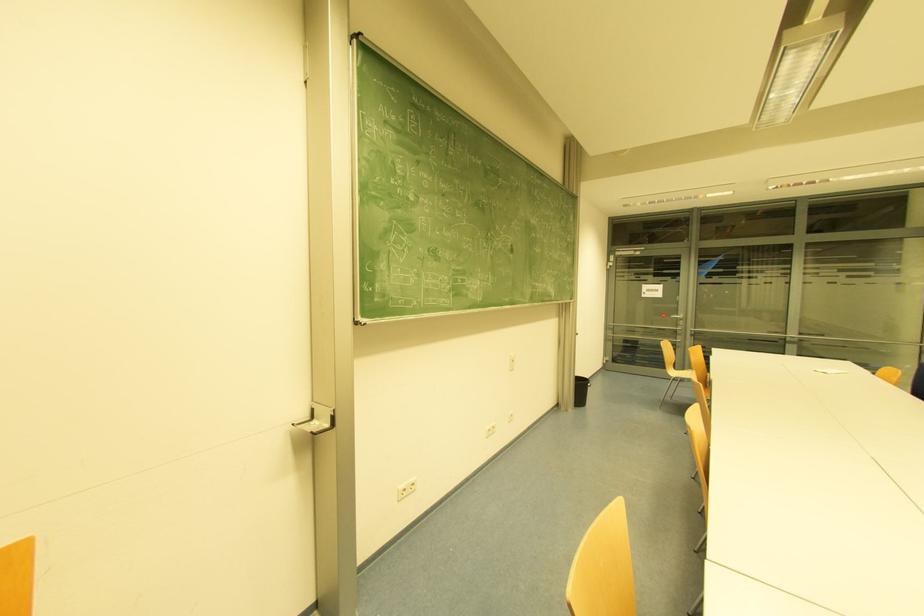
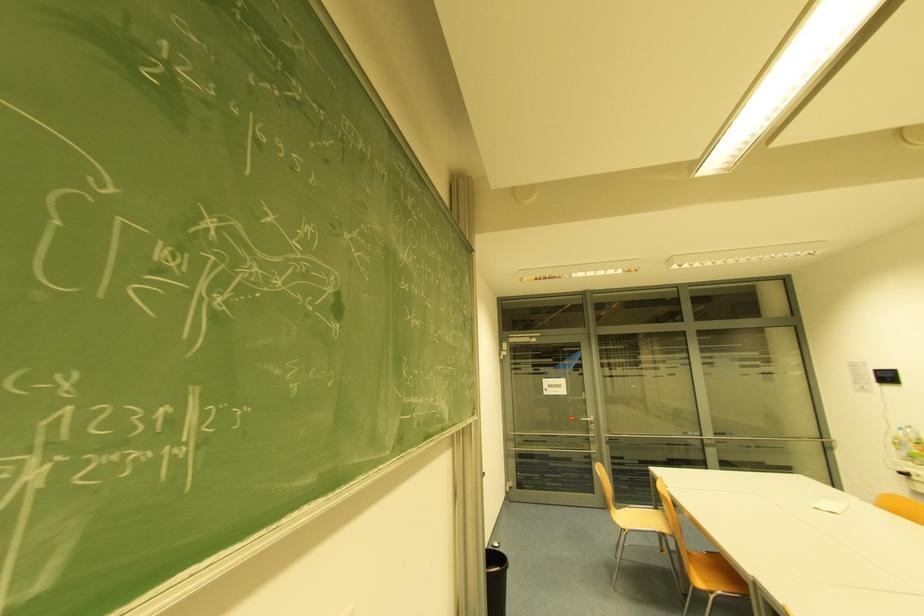
Question: The images are taken continuously from a first-person perspective. In which direction are you moving?

Choices:
 (A) Left
 (B) Right
 (C) Forward
 (D) Backward

Answer: (C)